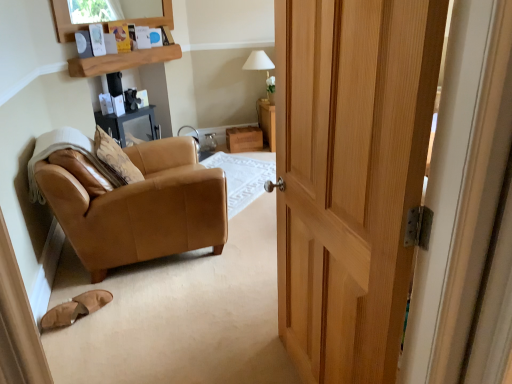
Locate an element on the screen. This screenshot has height=384, width=512. spots to the right of tan suede slippers at lower left is located at coordinates (126, 312).